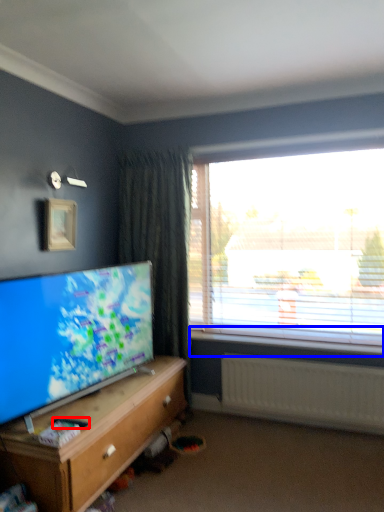
Question: Which object is closer to the camera taking this photo, remote control (highlighted by a red box) or window sill (highlighted by a blue box)?

Choices:
 (A) remote control
 (B) window sill

Answer: (A)